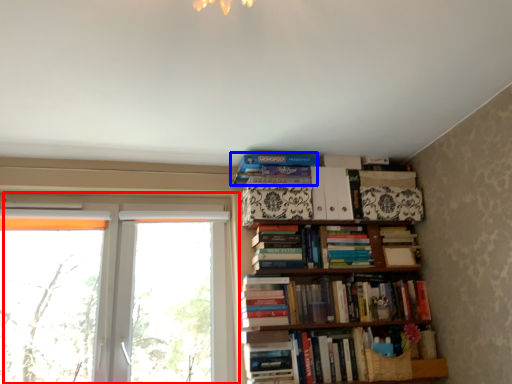
Question: Among these objects, which one is nearest to the camera, window (highlighted by a red box) or book (highlighted by a blue box)?

Choices:
 (A) window
 (B) book

Answer: (A)